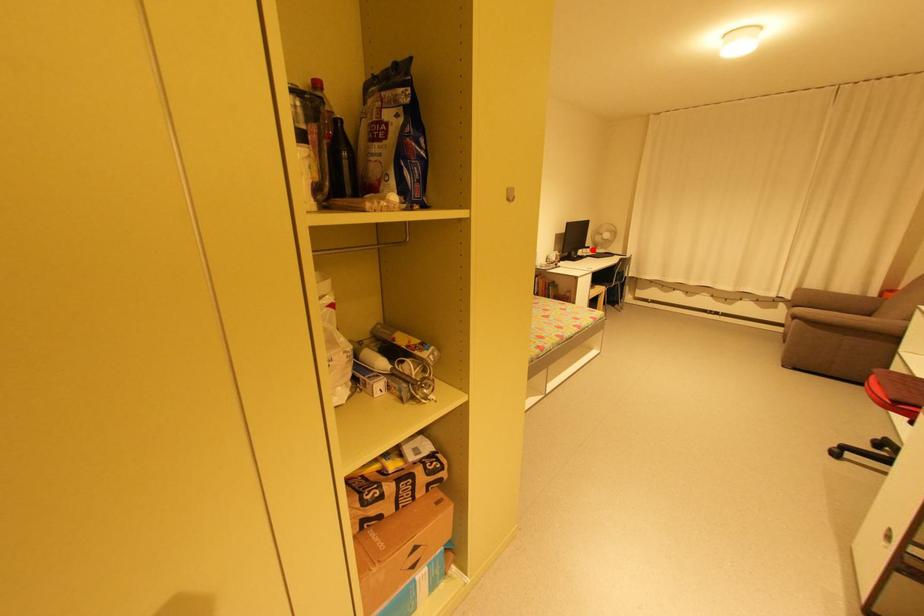
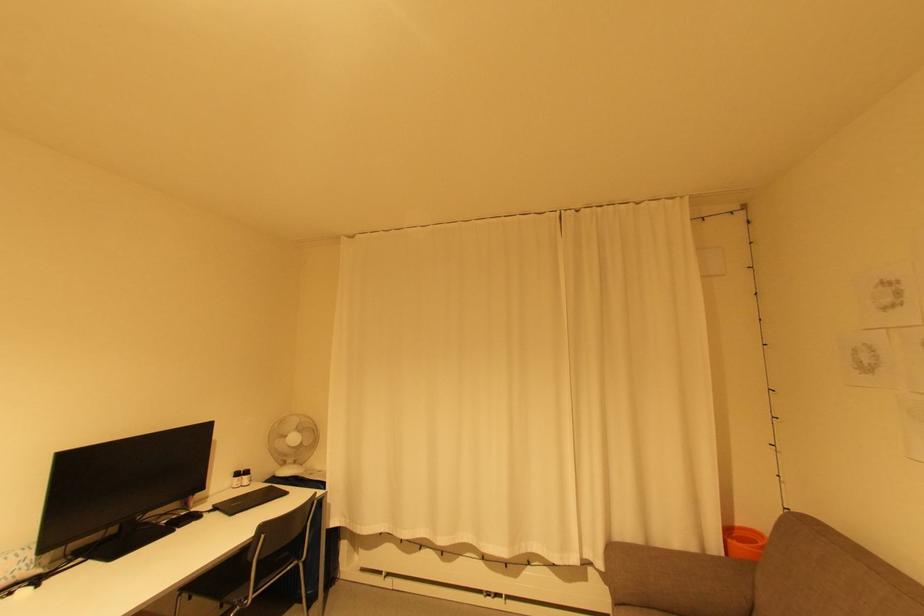
In the second image, find the point that corresponds to the highlighted location in the first image.

(250, 477)